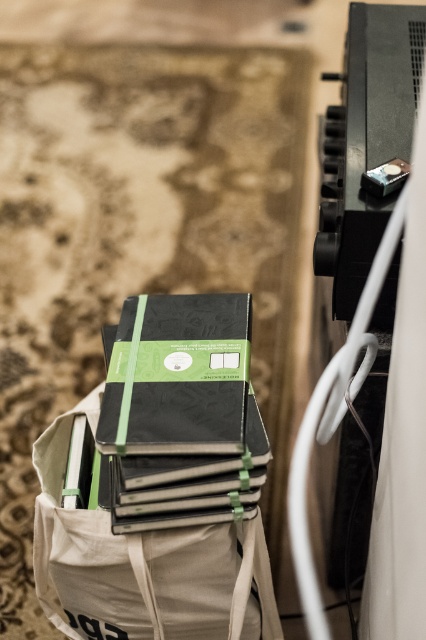
You are organizing your desk and see the canvas tote bag at center and the matte black notebook at center. Which object is positioned to the right side?

The matte black notebook at center is to the right of the canvas tote bag at center.

You have a small gift box that is 10 cm wide and want to place it on the canvas tote bag at center without overlapping the matte black notebook at center. Is there enough space on the tote bag at center for the gift box?

The canvas tote bag at center is wider than the matte black notebook at center. Since the gift box is 10 cm wide, there should be enough space on the canvas tote bag at center to place the gift box without overlapping the notebook.

You are organizing your desk and need to place the canvas tote bag at center and the matte black notebook at center closer together. How much distance do you need to reduce between them to make them touch?

The canvas tote bag at center and matte black notebook at center are currently 26.00 centimeters apart. To make them touch, you need to reduce the distance by 26.00 centimeters.